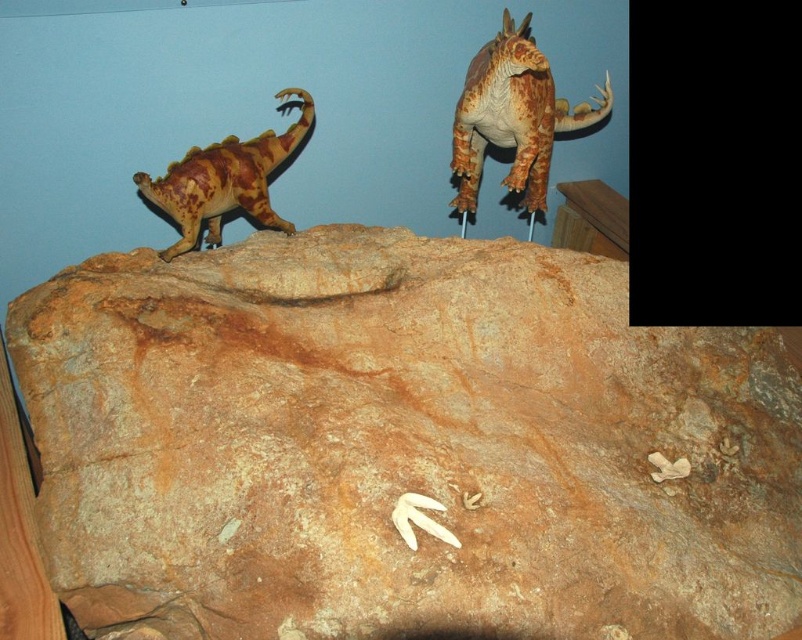
You are a child who wants to touch the brown rough rock at center. If you are standing 1.2 meters away from it, can you reach it without moving your feet?

The brown rough rock at center is 1.36 meters away from the viewer. Since you are standing 1.2 meters away, you are closer than the actual distance, so you can reach it without moving your feet.

Looking at this image, you are a collector who wants to place a new dinosaur model on the display. The new model is 10 cm tall. You need to ensure it doesn not block the view of the rusty metallic dinosaur at upper right. Given the height of the brown rough rock at center, where should you place the new model?

The brown rough rock at center has a greater height compared to the rusty metallic dinosaur at upper right. To avoid blocking the view of the rusty metallic dinosaur at upper right, the new model should be placed on the brown rough rock at center since it is taller than the dinosaur, allowing the dinosaur to remain visible.

You are a geologist examining the display setup. You need to locate the brown rough rock at center. What are its coordinates?

The brown rough rock at center is located at coordinates point (402, 444).